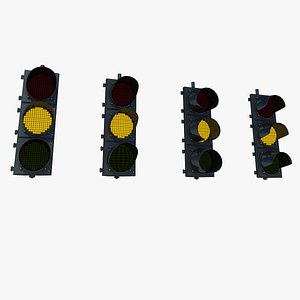
You are a GUI agent. You are given a task and a screenshot of the screen. Output one action in this format:
    pyautogui.click(x=<x>, y=<y>)
    Task: Click on the lights
    The width and height of the screenshot is (300, 300).
    Given the screenshot: What is the action you would take?
    [x=126, y=128]